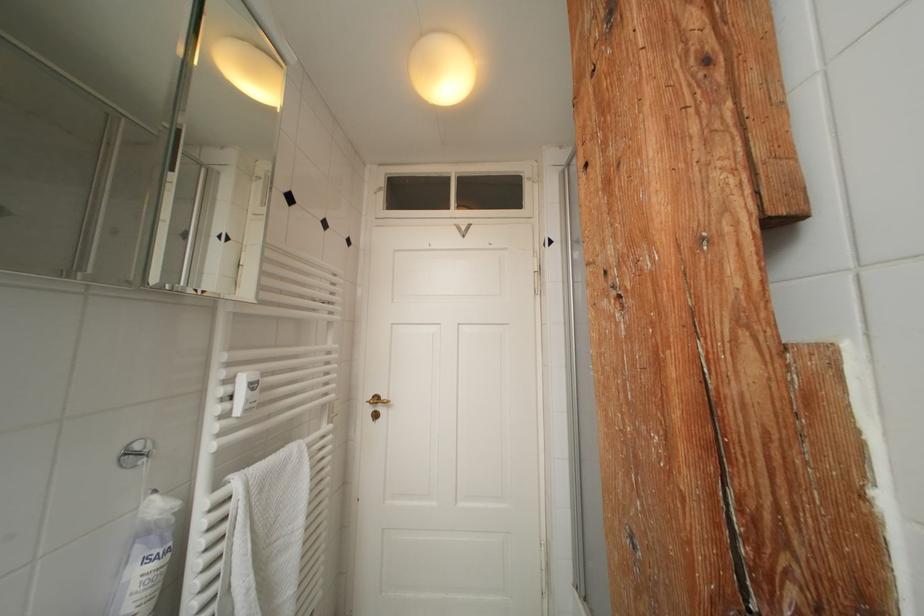
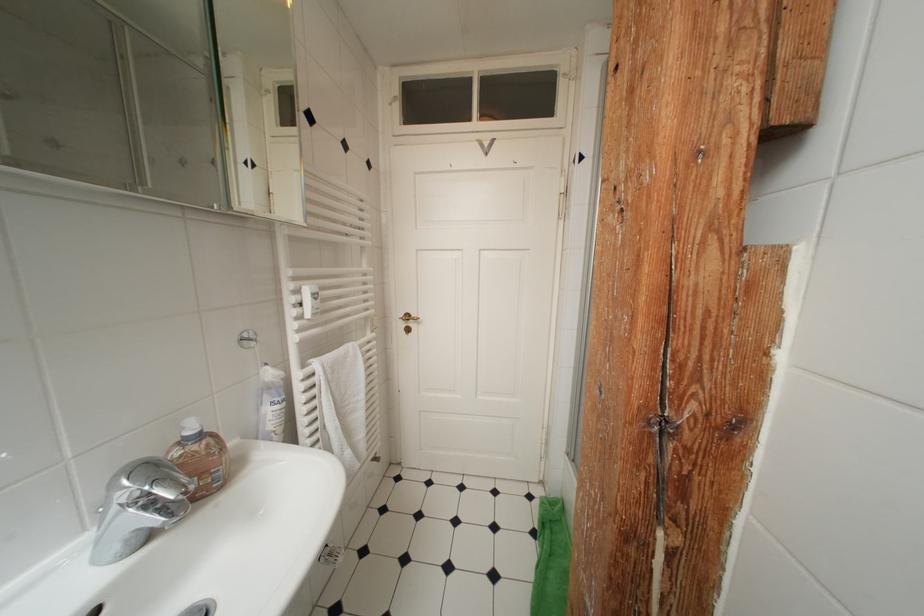
Where in the second image is the point corresponding to (x=226, y=240) from the first image?

(253, 167)